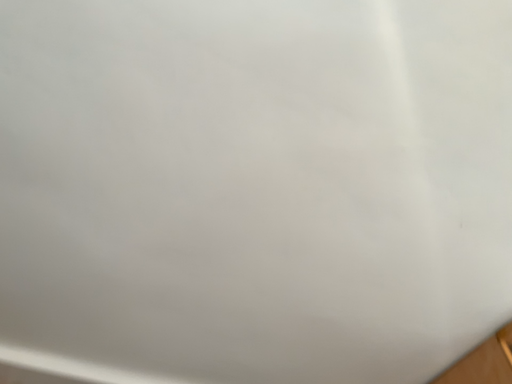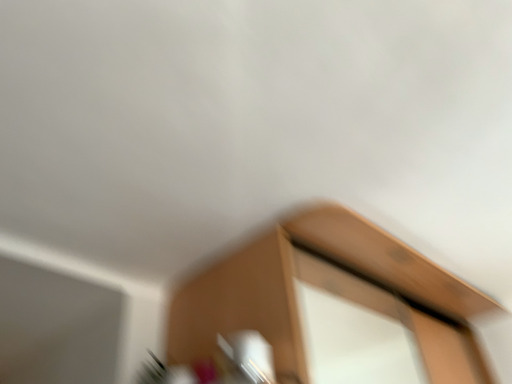
Question: Which way did the camera rotate in the video?

Choices:
 (A) rotated upward
 (B) rotated downward

Answer: (B)